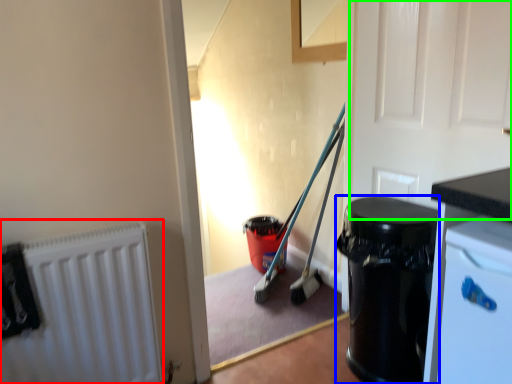
Question: Estimate the real-world distances between objects in this image. Which object is farther from radiator (highlighted by a red box), garbage (highlighted by a blue box) or door (highlighted by a green box)?

Choices:
 (A) garbage
 (B) door

Answer: (B)